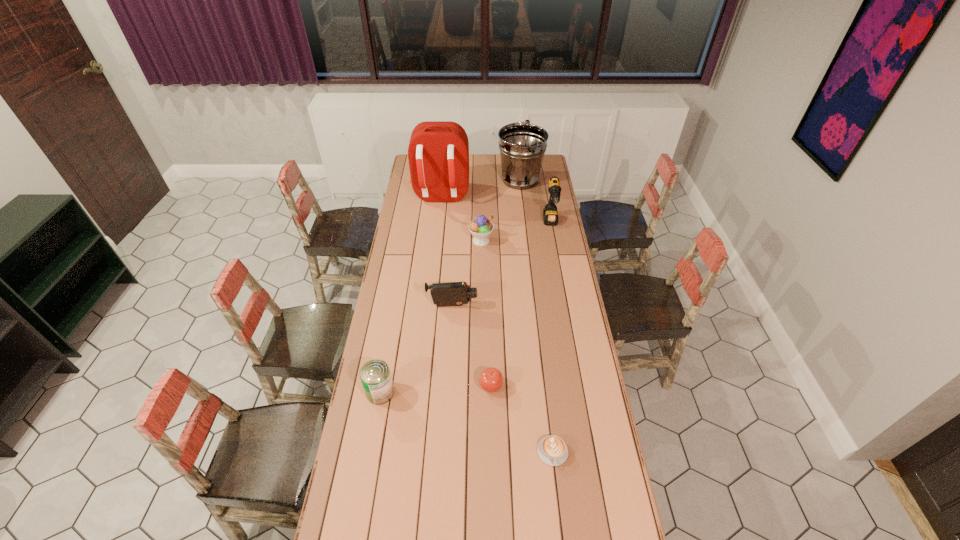
Where is `the tallest object`? the tallest object is located at coordinates (438, 153).

Find the location of a particular element. Image resolution: width=960 pixels, height=540 pixels. the seventh shortest object is located at coordinates (522, 146).

Locate an element on the screen. Image resolution: width=960 pixels, height=540 pixels. the sixth shortest object is located at coordinates (550, 214).

The height and width of the screenshot is (540, 960). Identify the location of icecream. (481, 227).

Where is `camcorder`? camcorder is located at coordinates (451, 293).

The height and width of the screenshot is (540, 960). Find the location of `can`. can is located at coordinates (375, 375).

Locate an element on the screen. This screenshot has width=960, height=540. apple is located at coordinates (491, 379).

Identify the location of the nearest object. The image size is (960, 540). (552, 450).

This screenshot has height=540, width=960. Find the location of `the shortest object`. the shortest object is located at coordinates (552, 450).

Where is `vacant space positioned on the strap side of the backpack`? This screenshot has height=540, width=960. vacant space positioned on the strap side of the backpack is located at coordinates (438, 224).